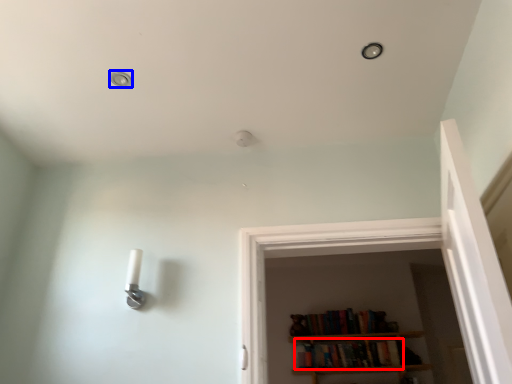
Question: Which object is further to the camera taking this photo, book (highlighted by a red box) or dot (highlighted by a blue box)?

Choices:
 (A) book
 (B) dot

Answer: (A)